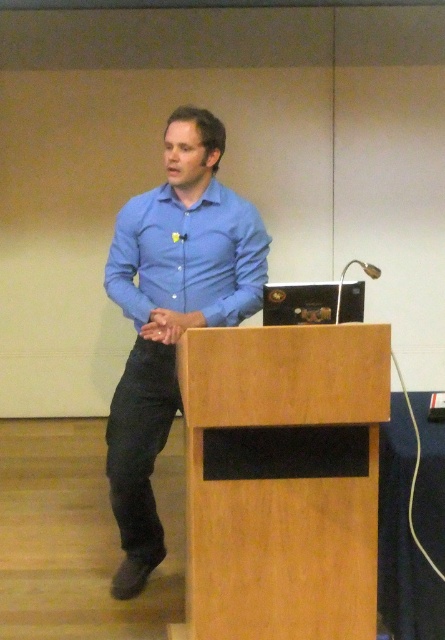
From the picture: Does blue cotton shirt at center appear on the left side of matte blue shirt at center?

Indeed, blue cotton shirt at center is positioned on the left side of matte blue shirt at center.

How much distance is there between blue cotton shirt at center and matte blue shirt at center?

The distance of blue cotton shirt at center from matte blue shirt at center is 3.17 inches.

Does point (122, 531) come farther from viewer compared to point (191, 301)?

Yes.

You are a GUI agent. You are given a task and a screenshot of the screen. Output one action in this format:
    pyautogui.click(x=<x>, y=<y>)
    Task: Click on the blue cotton shirt at center
    The width and height of the screenshot is (445, 640).
    Given the screenshot: What is the action you would take?
    pyautogui.click(x=172, y=314)

Based on the photo, is wooden podium at center taller than blue cotton shirt at center?

No.

Is wooden podium at center to the right of blue cotton shirt at center from the viewer's perspective?

Indeed, wooden podium at center is positioned on the right side of blue cotton shirt at center.

Is point (323, 465) in front of point (129, 481)?

Yes, it is.

Locate an element on the screen. wooden podium at center is located at coordinates (283, 480).

Based on the photo, can you confirm if wooden podium at center is positioned above matte blue shirt at center?

Actually, wooden podium at center is below matte blue shirt at center.

Between wooden podium at center and matte blue shirt at center, which one has less height?

With less height is matte blue shirt at center.

Is point (320, 480) more distant than point (255, 225)?

No.

Where is `wooden podium at center`? The width and height of the screenshot is (445, 640). wooden podium at center is located at coordinates (283, 480).